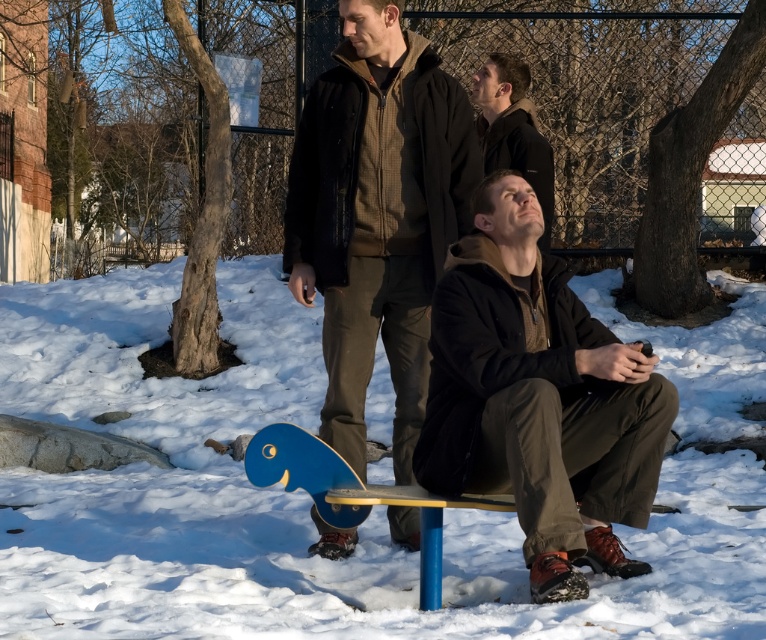
You are standing in the winter park scene and notice two jackets at the center. Which jacket is positioned lower between the dark brown jacket at center and the dark brown leather jacket at center?

The dark brown jacket at center is located below the dark brown leather jacket at center, so the dark brown jacket at center is positioned lower.